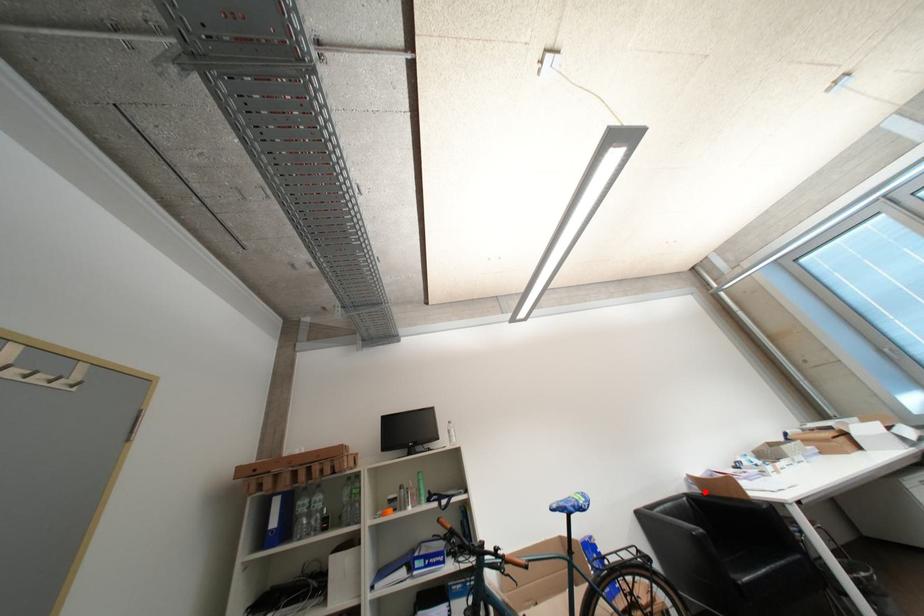
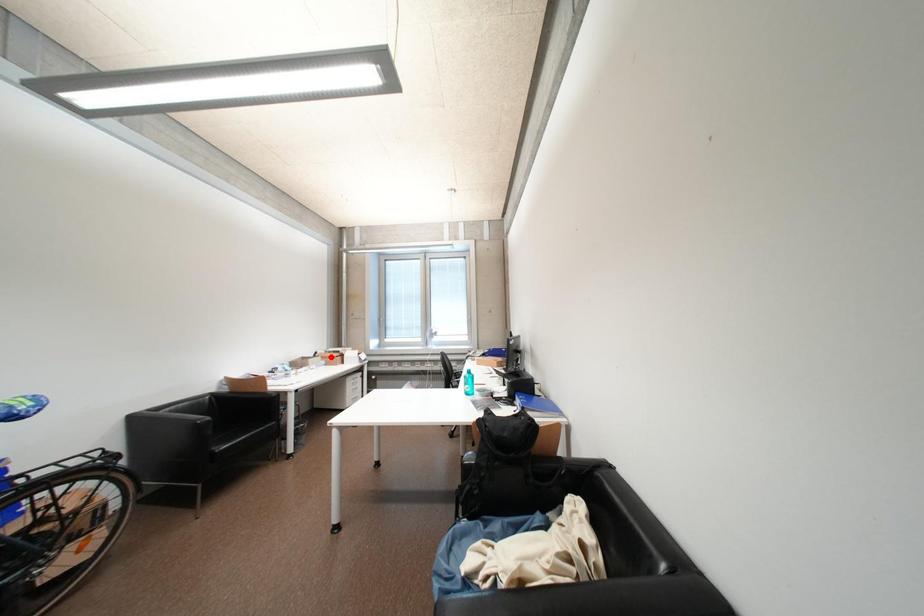
I am providing you with two images of the same scene from different viewpoints. A red point is marked on the first image and another point is marked on the second image. Does the point marked in image1 correspond to the same location as the one in image2?

No